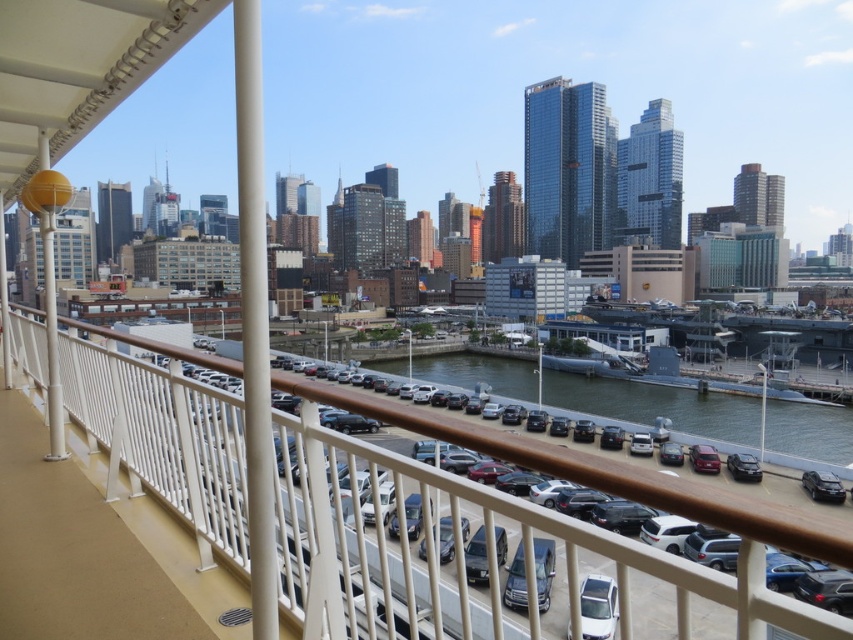
You are a delivery person trying to park your van in the parking lot. You see a white glossy car at center and a shiny black sedan at lower right. Which vehicle should you avoid if you need to park in a compact parking space designed for smaller vehicles?

You should avoid the white glossy car at center because it is bigger than the shiny black sedan at lower right, making it less suitable for a compact parking space.

You are standing on the balcony and want to see the shiny black sedan at lower right. Is the greenish water at lower center blocking your view of it?

The greenish water at lower center is above the shiny black sedan at lower right, so it is blocking the view of the shiny black sedan at lower right.